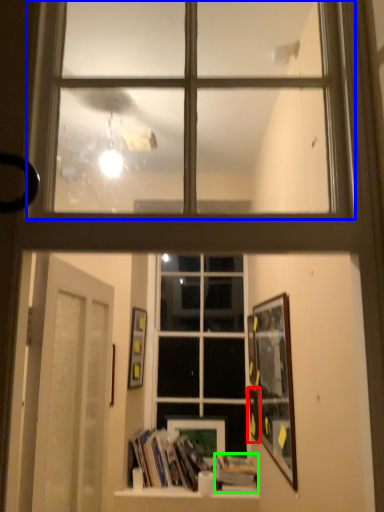
Question: Which object is the closest to the picture frame (highlighted by a red box)? Choose among these: window (highlighted by a blue box) or paperback book (highlighted by a green box).

Choices:
 (A) window
 (B) paperback book

Answer: (B)